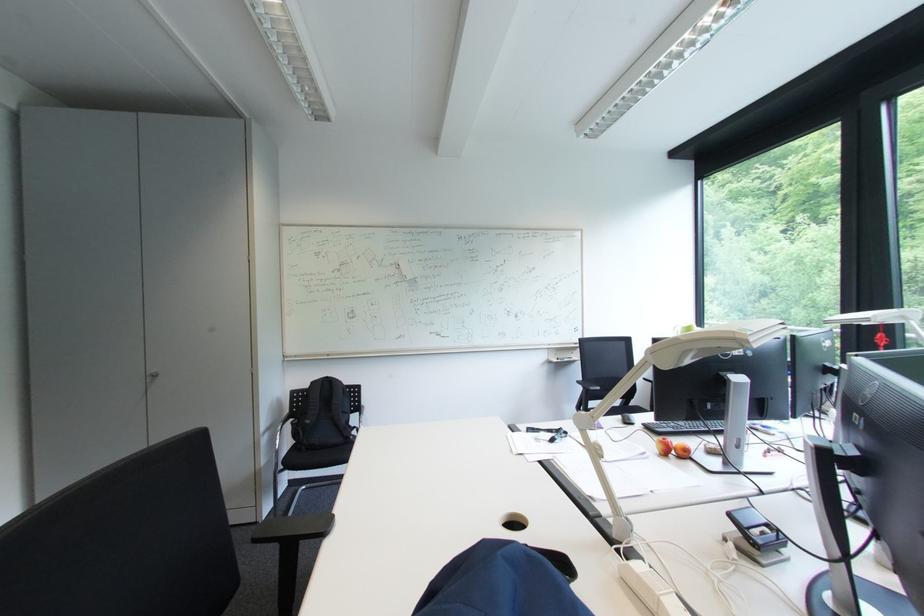
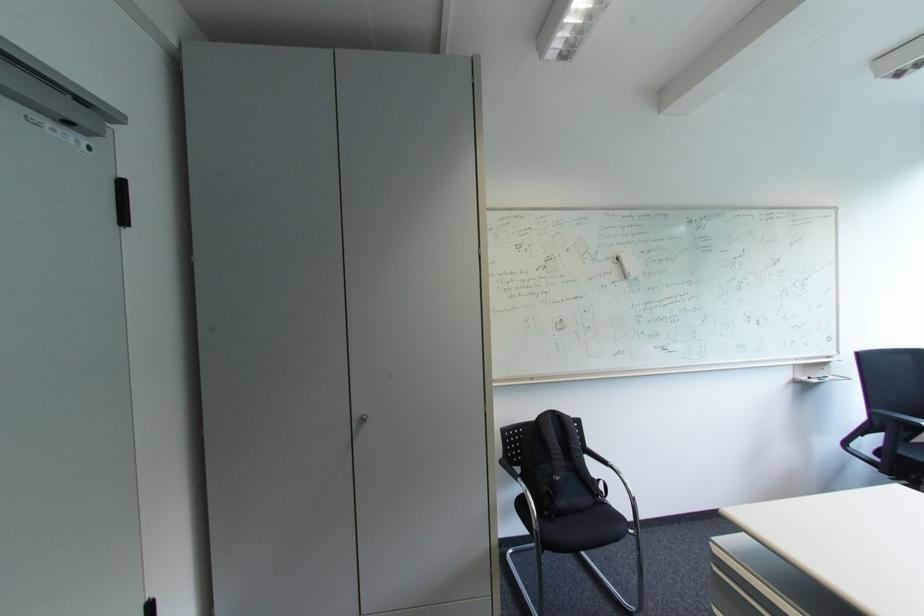
In the second image, find the point that corresponds to pixel 566 361 in the first image.

(819, 379)